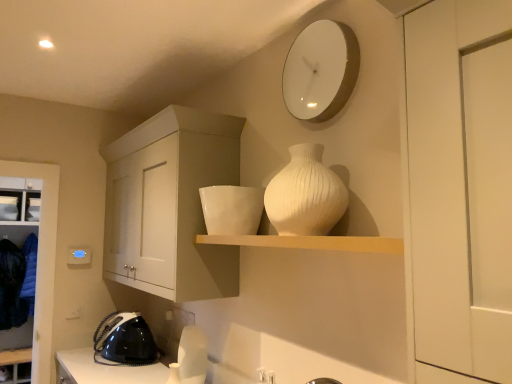
Question: Is metallic silver iron at left, marked as the third appliance in a right-to-left arrangement, taller or shorter than white matte shelf at upper center?

Choices:
 (A) tall
 (B) short

Answer: (A)

Question: Is metallic silver iron at left, marked as the 1th appliance in a back-to-front arrangement, inside the boundaries of white matte shelf at upper center, or outside?

Choices:
 (A) inside
 (B) outside

Answer: (B)

Question: Which object is the closest to the white glossy bowl at upper center, the 1th appliance positioned from the right?

Choices:
 (A) white glossy clock at upper center
 (B) black plastic iron at lower left, acting as the first appliance starting from the bottom
 (C) metallic silver iron at left, marked as the 1th appliance in a back-to-front arrangement
 (D) white matte shelf at upper center
 (E) white ribbed vase at center

Answer: (D)

Question: Considering the real-world distances, which object is farthest from the white matte cabinet at left, arranged as the first cabinetry when viewed from the back?

Choices:
 (A) dark blue fabric at lower left
 (B) metallic silver iron at left, marked as the 1th appliance in a back-to-front arrangement
 (C) white matte cabinet at upper left, which is the 1th cabinetry from right to left
 (D) white glossy clock at upper center
 (E) white glossy bowl at upper center, the 1th appliance from the top

Answer: (D)